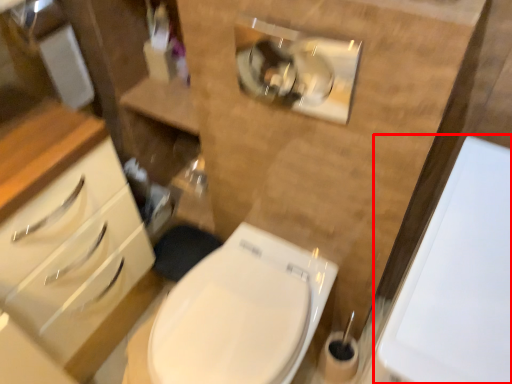
Question: Where is porcelain (annotated by the red box) located in relation to toilet in the image?

Choices:
 (A) right
 (B) left

Answer: (A)